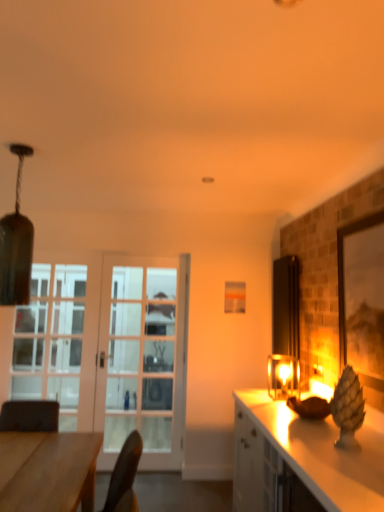
Question: Should I look upward or downward to see matte wooden picture frame at right?

Choices:
 (A) up
 (B) down

Answer: (B)

Question: Can you confirm if wooden desk at lower left is thinner than clear glass door at left?

Choices:
 (A) no
 (B) yes

Answer: (A)

Question: From the image's perspective, would you say wooden desk at lower left is positioned over clear glass door at left?

Choices:
 (A) yes
 (B) no

Answer: (B)

Question: From a real-world perspective, is wooden desk at lower left below clear glass door at left?

Choices:
 (A) yes
 (B) no

Answer: (A)

Question: Can you see wooden desk at lower left touching clear glass door at left?

Choices:
 (A) no
 (B) yes

Answer: (A)

Question: Is wooden desk at lower left surrounding clear glass door at left?

Choices:
 (A) yes
 (B) no

Answer: (B)

Question: Is wooden desk at lower left smaller than clear glass door at left?

Choices:
 (A) yes
 (B) no

Answer: (B)

Question: Does matte glass lampshade at right contain white glossy cabinet at right?

Choices:
 (A) yes
 (B) no

Answer: (B)

Question: Considering the relative positions of matte glass lampshade at right and white glossy cabinet at right in the image provided, is matte glass lampshade at right in front of white glossy cabinet at right?

Choices:
 (A) no
 (B) yes

Answer: (A)

Question: Can you confirm if matte glass lampshade at right is smaller than white glossy cabinet at right?

Choices:
 (A) no
 (B) yes

Answer: (B)

Question: From a real-world perspective, is matte glass lampshade at right physically below white glossy cabinet at right?

Choices:
 (A) yes
 (B) no

Answer: (B)

Question: Does matte glass lampshade at right come behind white glossy cabinet at right?

Choices:
 (A) no
 (B) yes

Answer: (B)

Question: Considering the relative sizes of matte glass lampshade at right and white glossy cabinet at right in the image provided, is matte glass lampshade at right thinner than white glossy cabinet at right?

Choices:
 (A) no
 (B) yes

Answer: (B)

Question: Does clear glass door at left have a smaller size compared to matte glass lampshade at upper left?

Choices:
 (A) no
 (B) yes

Answer: (A)